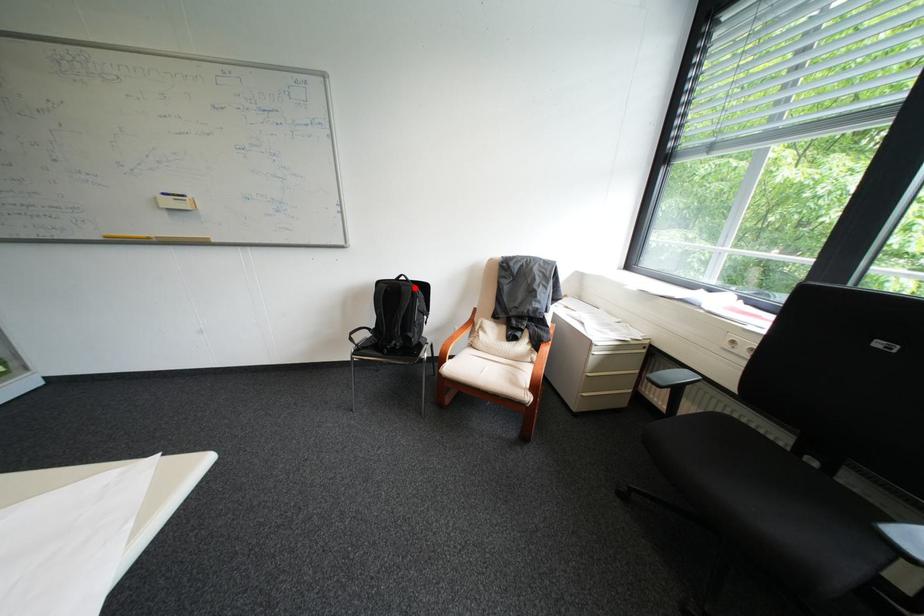
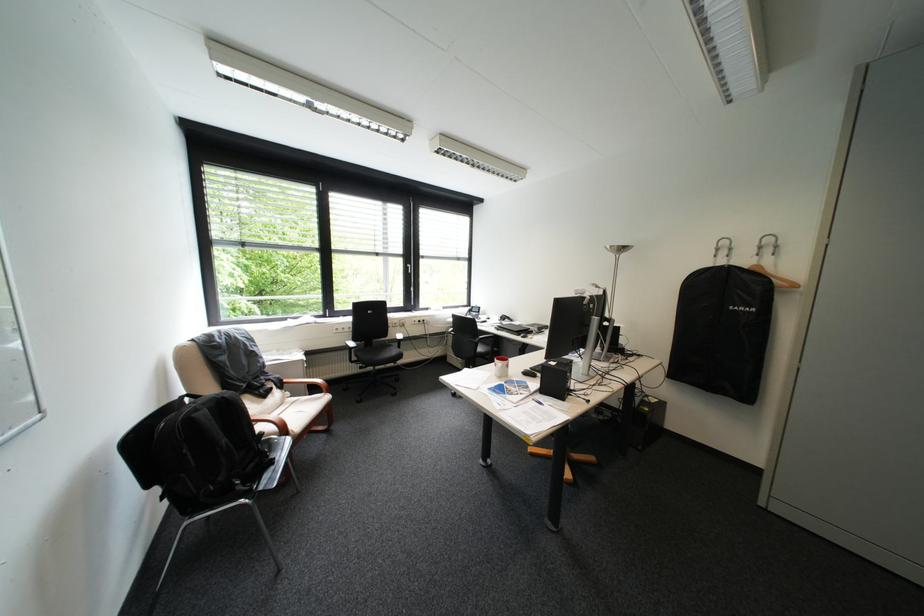
In the second image, find the point that corresponds to the highlighted location in the first image.

(236, 398)